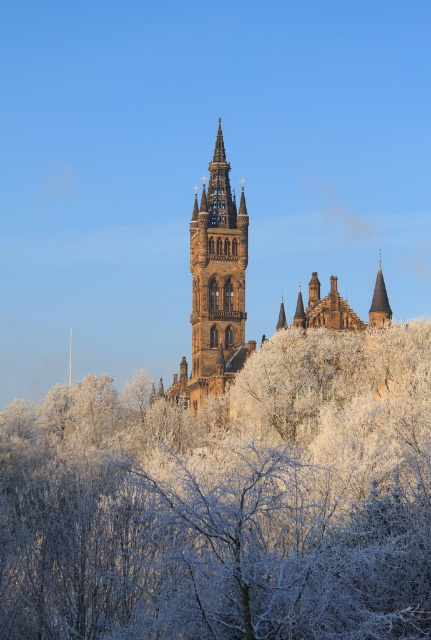
Who is taller, stone gothic tower at center or smooth brown spire at upper right?

Standing taller between the two is stone gothic tower at center.

Does stone gothic tower at center appear over smooth brown spire at upper right?

No.

Who is more forward, (218, 342) or (387, 305)?

Positioned in front is point (387, 305).

Where is `stone gothic tower at center`? stone gothic tower at center is located at coordinates (215, 289).

At what (x,y) coordinates should I click in order to perform the action: click on brown stone church at center. Please return your answer as a coordinate pair (x, y). The image size is (431, 640). Looking at the image, I should click on (215, 289).

Does point (224, 292) come in front of point (381, 278)?

No, it is behind (381, 278).

Identify the location of brown stone church at center. Image resolution: width=431 pixels, height=640 pixels. (215, 289).

Is frosted white branches at center smaller than smooth brown spire at upper right?

No, frosted white branches at center is not smaller than smooth brown spire at upper right.

Between frosted white branches at center and smooth brown spire at upper right, which one is positioned lower?

Positioned lower is frosted white branches at center.

Describe the element at coordinates (227, 500) in the screenshot. I see `frosted white branches at center` at that location.

This screenshot has width=431, height=640. In order to click on frosted white branches at center in this screenshot , I will do `click(227, 500)`.